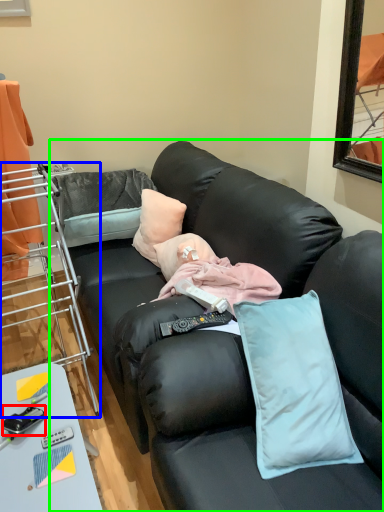
Question: Which is farther away from equipment (highlighted by a red box)? cabinetry (highlighted by a blue box) or studio couch (highlighted by a green box)?

Choices:
 (A) cabinetry
 (B) studio couch

Answer: (A)